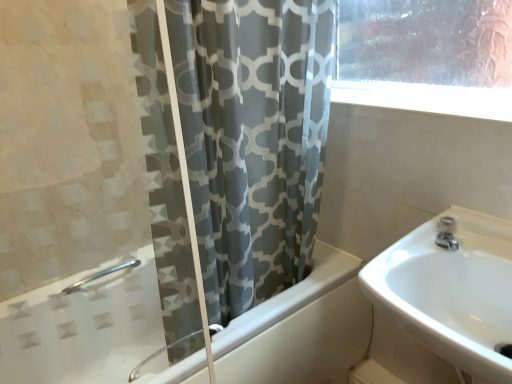
Question: Is white glossy sink at right taller or shorter than gray fabric curtain at center?

Choices:
 (A) tall
 (B) short

Answer: (B)

Question: Would you say white glossy sink at right is to the left or to the right of gray fabric curtain at center in the picture?

Choices:
 (A) left
 (B) right

Answer: (B)

Question: Which object is the closest to the satin nickel faucet at upper right?

Choices:
 (A) gray fabric curtain at center
 (B) white glossy bathtub at center
 (C) white glossy sink at right

Answer: (C)

Question: Estimate the real-world distances between objects in this image. Which object is closer to the white glossy bathtub at center?

Choices:
 (A) satin nickel faucet at upper right
 (B) gray fabric curtain at center
 (C) white glossy sink at right

Answer: (B)